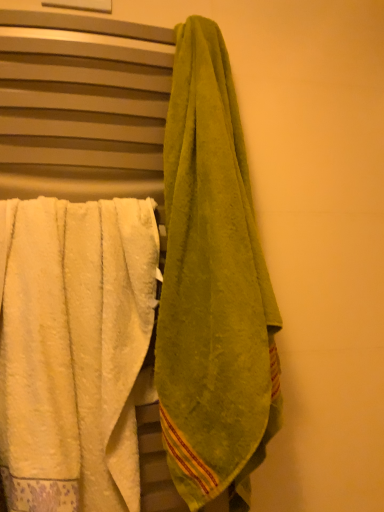
I want to click on green cotton towel at right, so click(83, 106).

This screenshot has height=512, width=384. Identify the location of white fluffy towel at left, the 2th towel viewed from the right. (74, 350).

The image size is (384, 512). Describe the element at coordinates (212, 286) in the screenshot. I see `green terry cloth towel at right, which appears as the 1th towel when viewed from the right` at that location.

Image resolution: width=384 pixels, height=512 pixels. In order to click on green cotton towel at right in this screenshot , I will do `click(83, 106)`.

Is white fluffy towel at left, the 2th towel viewed from the right, oriented away from green terry cloth towel at right, positioned as the 2th towel in left-to-right order?

No, green terry cloth towel at right, positioned as the 2th towel in left-to-right order, is not at the back of white fluffy towel at left, the 2th towel viewed from the right.

From the image's perspective, would you say white fluffy towel at left, the 2th towel viewed from the right, is positioned over green terry cloth towel at right, positioned as the 2th towel in left-to-right order?

Incorrect, from the image's perspective, white fluffy towel at left, the 2th towel viewed from the right, is lower than green terry cloth towel at right, positioned as the 2th towel in left-to-right order.

Where is `towel that appears above the white fluffy towel at left, marked as the 1th towel in a left-to-right arrangement (from a real-world perspective)`? towel that appears above the white fluffy towel at left, marked as the 1th towel in a left-to-right arrangement (from a real-world perspective) is located at coordinates (212, 286).

Does point (0, 233) come in front of point (217, 148)?

Yes, point (0, 233) is in front of point (217, 148).

Based on the photo, would you say green cotton towel at right is a long distance from green terry cloth towel at right, positioned as the 2th towel in left-to-right order?

No.

From the image's perspective, is green cotton towel at right positioned above or below green terry cloth towel at right, which appears as the 1th towel when viewed from the right?

Clearly, from the image's perspective, green cotton towel at right is below green terry cloth towel at right, which appears as the 1th towel when viewed from the right.

In terms of width, does green cotton towel at right look wider or thinner when compared to green terry cloth towel at right, positioned as the 2th towel in left-to-right order?

Considering their sizes, green cotton towel at right looks slimmer than green terry cloth towel at right, positioned as the 2th towel in left-to-right order.

Who is shorter, white fluffy towel at left, marked as the 1th towel in a left-to-right arrangement, or green cotton towel at right?

white fluffy towel at left, marked as the 1th towel in a left-to-right arrangement.

Considering the sizes of objects white fluffy towel at left, marked as the 1th towel in a left-to-right arrangement, and green cotton towel at right in the image provided, who is smaller, white fluffy towel at left, marked as the 1th towel in a left-to-right arrangement, or green cotton towel at right?

white fluffy towel at left, marked as the 1th towel in a left-to-right arrangement.

From a real-world perspective, does white fluffy towel at left, marked as the 1th towel in a left-to-right arrangement, stand above green cotton towel at right?

Incorrect, from a real-world perspective, white fluffy towel at left, marked as the 1th towel in a left-to-right arrangement, is lower than green cotton towel at right.

Between white fluffy towel at left, marked as the 1th towel in a left-to-right arrangement, and green cotton towel at right, which one is positioned in front?

white fluffy towel at left, marked as the 1th towel in a left-to-right arrangement, is in front.

Can you confirm if green cotton towel at right is shorter than white fluffy towel at left, the 2th towel viewed from the right?

No.

Is point (109, 126) in front of point (51, 217)?

No, it is not.

Between green cotton towel at right and white fluffy towel at left, marked as the 1th towel in a left-to-right arrangement, which one has smaller size?

Smaller between the two is white fluffy towel at left, marked as the 1th towel in a left-to-right arrangement.

Does green terry cloth towel at right, positioned as the 2th towel in left-to-right order, contain white fluffy towel at left, marked as the 1th towel in a left-to-right arrangement?

No, white fluffy towel at left, marked as the 1th towel in a left-to-right arrangement, is not inside green terry cloth towel at right, positioned as the 2th towel in left-to-right order.

From the image's perspective, is green terry cloth towel at right, which appears as the 1th towel when viewed from the right, located beneath white fluffy towel at left, marked as the 1th towel in a left-to-right arrangement?

No.

Does green terry cloth towel at right, which appears as the 1th towel when viewed from the right, appear on the left side of white fluffy towel at left, the 2th towel viewed from the right?

No.

How much distance is there between green terry cloth towel at right, positioned as the 2th towel in left-to-right order, and white fluffy towel at left, the 2th towel viewed from the right?

A distance of 6.21 inches exists between green terry cloth towel at right, positioned as the 2th towel in left-to-right order, and white fluffy towel at left, the 2th towel viewed from the right.

Is green terry cloth towel at right, which appears as the 1th towel when viewed from the right, positioned with its back to green cotton towel at right?

Yes, green cotton towel at right is at the back of green terry cloth towel at right, which appears as the 1th towel when viewed from the right.

From a real-world perspective, is green terry cloth towel at right, positioned as the 2th towel in left-to-right order, above or below green cotton towel at right?

green terry cloth towel at right, positioned as the 2th towel in left-to-right order, is situated higher than green cotton towel at right in the real world.

Considering the sizes of green terry cloth towel at right, which appears as the 1th towel when viewed from the right, and green cotton towel at right in the image, is green terry cloth towel at right, which appears as the 1th towel when viewed from the right, taller or shorter than green cotton towel at right?

Considering their sizes, green terry cloth towel at right, which appears as the 1th towel when viewed from the right, has less height than green cotton towel at right.

Is green terry cloth towel at right, which appears as the 1th towel when viewed from the right, surrounding green cotton towel at right?

No, green terry cloth towel at right, which appears as the 1th towel when viewed from the right, does not contain green cotton towel at right.

At what (x,y) coordinates should I click in order to perform the action: click on towel on the left side of green terry cloth towel at right, positioned as the 2th towel in left-to-right order. Please return your answer as a coordinate pair (x, y). The height and width of the screenshot is (512, 384). Looking at the image, I should click on (74, 350).

At what (x,y) coordinates should I click in order to perform the action: click on laundry below the green terry cloth towel at right, which appears as the 1th towel when viewed from the right (from the image's perspective). Please return your answer as a coordinate pair (x, y). This screenshot has height=512, width=384. Looking at the image, I should click on (83, 106).

When comparing their distances from white fluffy towel at left, marked as the 1th towel in a left-to-right arrangement, does green cotton towel at right or green terry cloth towel at right, which appears as the 1th towel when viewed from the right, seem further?

green terry cloth towel at right, which appears as the 1th towel when viewed from the right.

Estimate the real-world distances between objects in this image. Which object is closer to white fluffy towel at left, the 2th towel viewed from the right, green terry cloth towel at right, positioned as the 2th towel in left-to-right order, or green cotton towel at right?

Based on the image, green cotton towel at right appears to be nearer to white fluffy towel at left, the 2th towel viewed from the right.

Considering their positions, is white fluffy towel at left, the 2th towel viewed from the right, positioned further to green terry cloth towel at right, positioned as the 2th towel in left-to-right order, than green cotton towel at right?

Among the two, white fluffy towel at left, the 2th towel viewed from the right, is located further to green terry cloth towel at right, positioned as the 2th towel in left-to-right order.

Estimate the real-world distances between objects in this image. Which object is further from green terry cloth towel at right, positioned as the 2th towel in left-to-right order, green cotton towel at right or white fluffy towel at left, marked as the 1th towel in a left-to-right arrangement?

Among the two, white fluffy towel at left, marked as the 1th towel in a left-to-right arrangement, is located further to green terry cloth towel at right, positioned as the 2th towel in left-to-right order.

Consider the image. Based on their spatial positions, is green terry cloth towel at right, which appears as the 1th towel when viewed from the right, or white fluffy towel at left, the 2th towel viewed from the right, closer to green cotton towel at right?

green terry cloth towel at right, which appears as the 1th towel when viewed from the right.

Considering their positions, is white fluffy towel at left, the 2th towel viewed from the right, positioned further to green cotton towel at right than green terry cloth towel at right, positioned as the 2th towel in left-to-right order?

white fluffy towel at left, the 2th towel viewed from the right, is further to green cotton towel at right.

At what (x,y) coordinates should I click in order to perform the action: click on laundry between white fluffy towel at left, marked as the 1th towel in a left-to-right arrangement, and green terry cloth towel at right, which appears as the 1th towel when viewed from the right, from left to right. Please return your answer as a coordinate pair (x, y). The image size is (384, 512). Looking at the image, I should click on (83, 106).